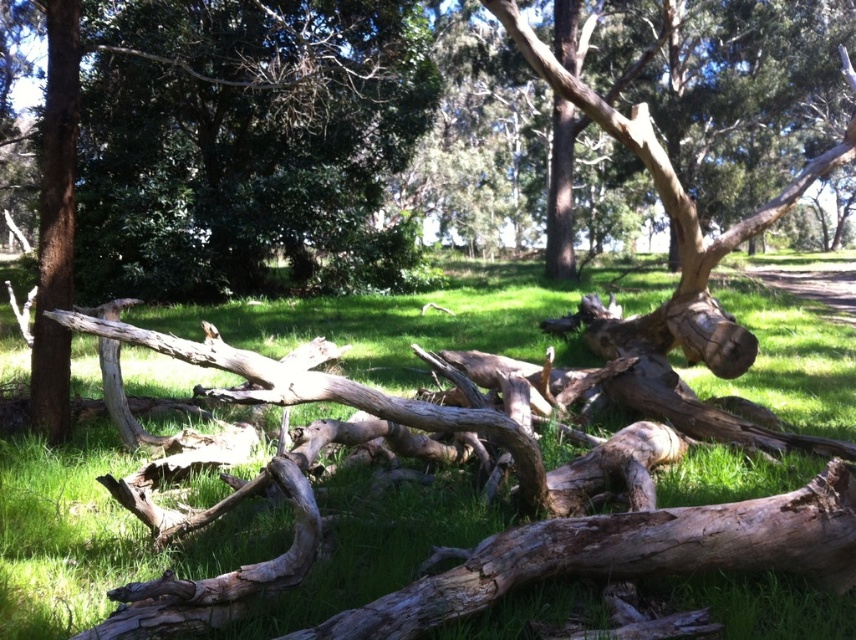
Question: Is brown rough tree trunk at left to the left of smooth brown tree trunk at center from the viewer's perspective?

Choices:
 (A) yes
 (B) no

Answer: (A)

Question: Considering the relative positions of brown rough wood at center and brown rough tree trunk at left in the image provided, where is brown rough wood at center located with respect to brown rough tree trunk at left?

Choices:
 (A) below
 (B) above

Answer: (B)

Question: Among these points, which one is nearest to the camera?

Choices:
 (A) (278, 538)
 (B) (483, 4)

Answer: (A)

Question: Which of the following is the farthest from the observer?

Choices:
 (A) brown rough wood at center
 (B) green grassy at center

Answer: (A)

Question: Which object is closer to the camera taking this photo?

Choices:
 (A) brown rough tree trunk at left
 (B) brown rough wood at center
 (C) drab brown log at center
 (D) green grassy at center

Answer: (C)

Question: Is green grassy at center further to the viewer compared to smooth brown tree trunk at center?

Choices:
 (A) no
 (B) yes

Answer: (A)